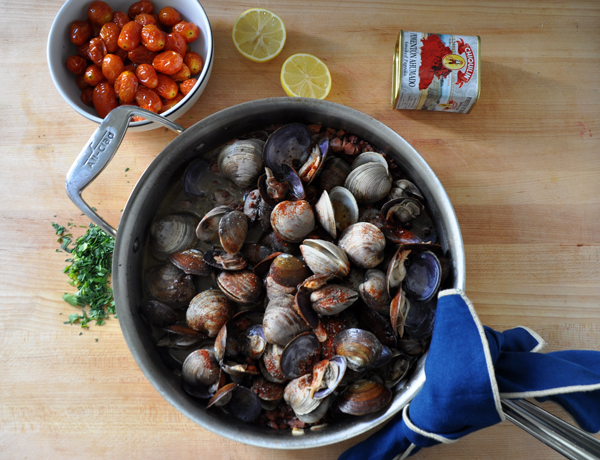
Find the location of a particular element. The width and height of the screenshot is (600, 460). blue cloth heat resistant product wrapped around handle of pot is located at coordinates (454, 394).